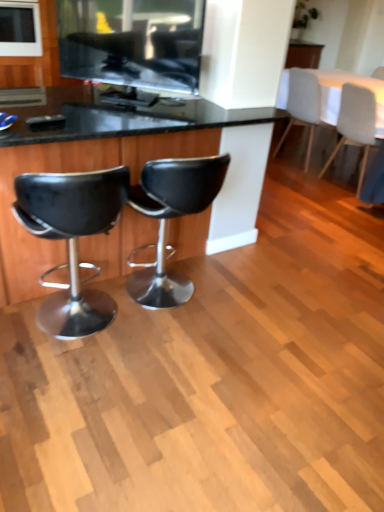
At what (x,y) coordinates should I click in order to perform the action: click on unoccupied region to the right of black leather desk at center. Please return your answer as a coordinate pair (x, y). The width and height of the screenshot is (384, 512). Looking at the image, I should click on (287, 296).